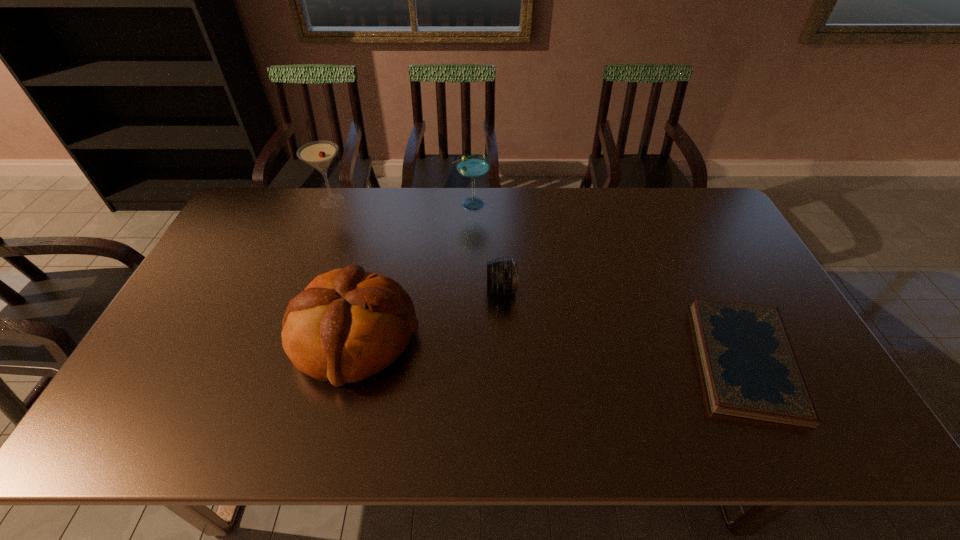
The width and height of the screenshot is (960, 540). I want to click on empty space between the shortest object and the bread, so click(549, 348).

Identify which object is the third closest to the telephoto lens. Please provide its 2D coordinates. Your answer should be formatted as a tuple, i.e. [(x, y)], where the tuple contains the x and y coordinates of a point satisfying the conditions above.

[(750, 368)]

Image resolution: width=960 pixels, height=540 pixels. What are the coordinates of `object identified as the fourth closest to the taller martini` in the screenshot? It's located at (750, 368).

The image size is (960, 540). Identify the location of free point that satisfies the following two spatial constraints: 1. at the front element of the telephoto lens; 2. on the right side of the rightmost object. (505, 360).

The width and height of the screenshot is (960, 540). What are the coordinates of `vacant region that satisfies the following two spatial constraints: 1. at the front element of the second shortest object; 2. on the left side of the rightmost object` in the screenshot? It's located at (505, 360).

Where is `vacant region that satisfies the following two spatial constraints: 1. on the back side of the shortest object; 2. at the front element of the second shortest object`? This screenshot has width=960, height=540. vacant region that satisfies the following two spatial constraints: 1. on the back side of the shortest object; 2. at the front element of the second shortest object is located at coordinates (709, 289).

Locate an element on the screen. This screenshot has height=540, width=960. vacant region that satisfies the following two spatial constraints: 1. on the back side of the paperback book; 2. at the front element of the fourth tallest object is located at coordinates [x=709, y=289].

The width and height of the screenshot is (960, 540). In order to click on vacant position in the image that satisfies the following two spatial constraints: 1. at the front element of the telephoto lens; 2. on the front side of the bread in this screenshot , I will do `click(504, 336)`.

The image size is (960, 540). In order to click on vacant space that satisfies the following two spatial constraints: 1. on the front side of the rightmost object; 2. on the right side of the bread in this screenshot , I will do `click(348, 360)`.

Where is `free space that satisfies the following two spatial constraints: 1. at the front element of the rightmost object; 2. on the right side of the telephoto lens`? The height and width of the screenshot is (540, 960). free space that satisfies the following two spatial constraints: 1. at the front element of the rightmost object; 2. on the right side of the telephoto lens is located at coordinates (x=505, y=360).